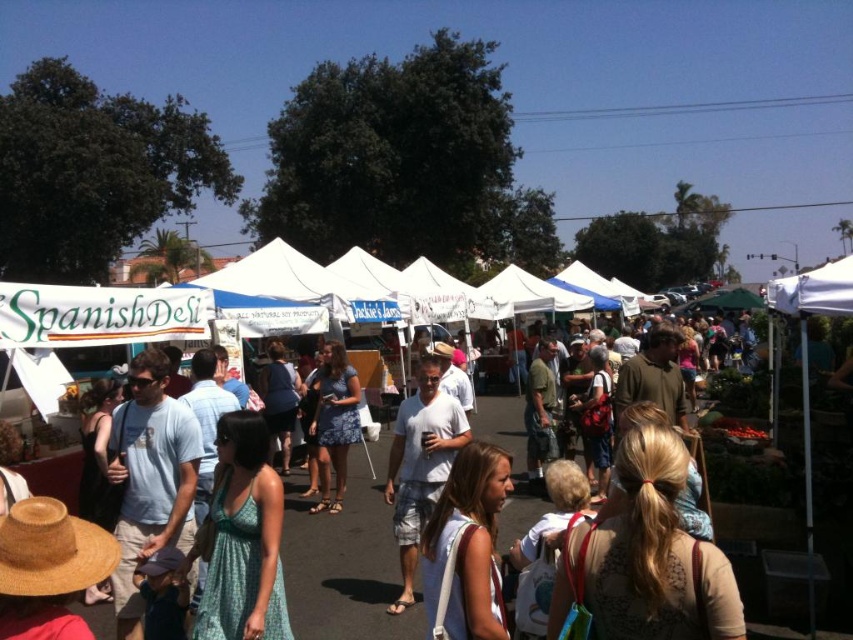
Based on the photo, you are a photographer standing at the edge of the market. You want to take a photo of the matte blue dress at center without the white fabric spanish deli at center blocking it. Is this possible given their current positions?

The white fabric spanish deli at center is in front of the matte blue dress at center, so it is blocking the view. To take a photo of the matte blue dress at center without the white fabric spanish deli at center blocking it, you would need to move around to a different angle where the dress is visible without the deli tent in front.